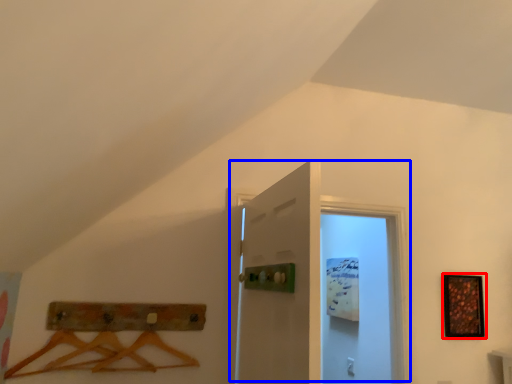
Question: Among these objects, which one is nearest to the camera, picture frame (highlighted by a red box) or door (highlighted by a blue box)?

Choices:
 (A) picture frame
 (B) door

Answer: (B)